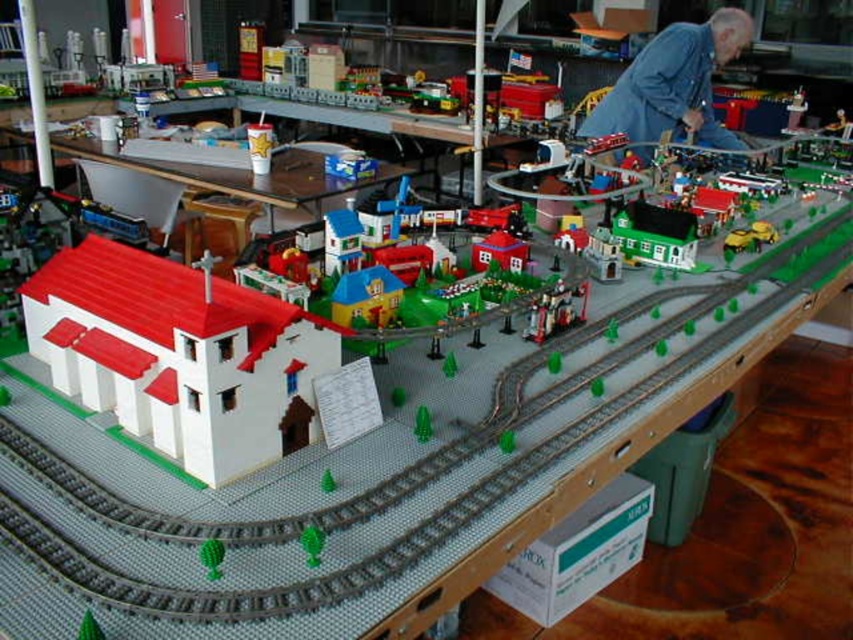
Based on the photo, you are a model train enthusiast examining the LEGO diorama. You notice the blue denim shirt at upper right and the green matte house at center. Which object takes up more space in the scene?

The blue denim shirt at upper right is bigger than the green matte house at center, so it takes up more space in the scene.

You are looking at the model train set and want to place a new miniature tree between the two points marked as point [674,40] and point [625,224]. Based on their positions, which point is closer to you where you should start placing the tree?

Point [674,40] is closer to you, so you should start placing the tree near that point since it is closer than point [625,224].

You are a visitor observing the model train set and notice the green matte house at center and the matte plastic train at center. From your perspective, which object is positioned to the left?

The matte plastic train at center is to the left of the green matte house at center.